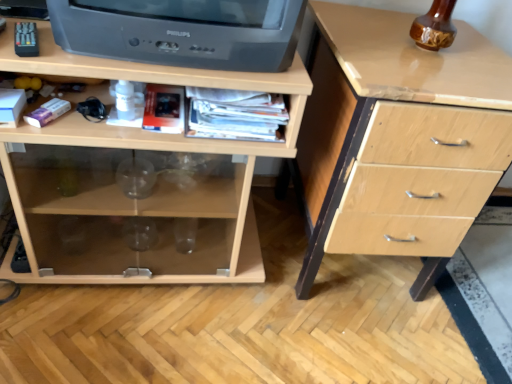
Locate an element on the screen. free space in front of light wood chest of drawers at center, arranged as the 2th chest of drawers when viewed from the right is located at coordinates (122, 334).